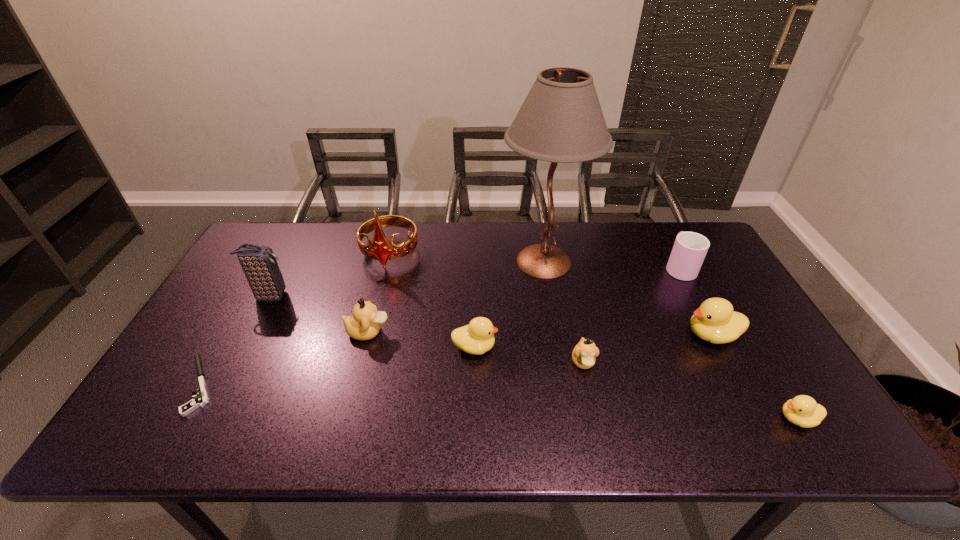
The width and height of the screenshot is (960, 540). I want to click on vacant space located 0.230m on the beak of the smallest yellow duckling, so click(677, 418).

You are a GUI agent. You are given a task and a screenshot of the screen. Output one action in this format:
    pyautogui.click(x=<x>, y=<y>)
    Task: Click on the free location located on the beak of the smallest yellow duckling
    The width and height of the screenshot is (960, 540).
    Given the screenshot: What is the action you would take?
    pyautogui.click(x=677, y=418)

Find the location of a particular element. The image size is (960, 540). free space located 0.150m on the beak of the smallest yellow duckling is located at coordinates (711, 418).

Find the location of a particular element. The height and width of the screenshot is (540, 960). table lamp at the far edge is located at coordinates (561, 121).

The width and height of the screenshot is (960, 540). I want to click on tiara that is positioned at the far edge, so click(381, 249).

At what (x,y) coordinates should I click in order to perform the action: click on cup that is at the far edge. Please return your answer as a coordinate pair (x, y). This screenshot has width=960, height=540. Looking at the image, I should click on (690, 248).

Where is `duckling that is at the near edge`? The image size is (960, 540). duckling that is at the near edge is located at coordinates (802, 410).

Identify the location of pistol that is at the near edge. The height and width of the screenshot is (540, 960). (201, 400).

Locate an element on the screen. This screenshot has height=540, width=960. clutch bag located at the left edge is located at coordinates (259, 264).

You are a GUI agent. You are given a task and a screenshot of the screen. Output one action in this format:
    pyautogui.click(x=<x>, y=<y>)
    Task: Click on the pistol at the left edge
    The image size is (960, 540).
    Given the screenshot: What is the action you would take?
    pyautogui.click(x=201, y=400)